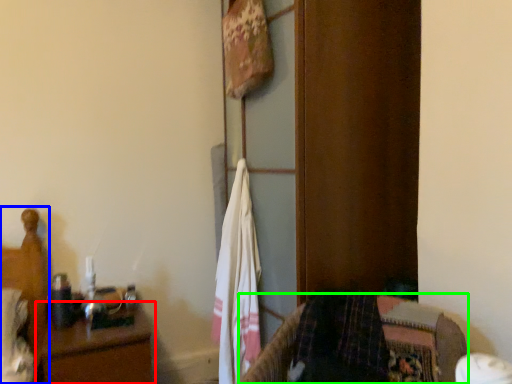
Question: Based on their relative distances, which object is farther from nightstand (highlighted by a red box)? Choose from bed (highlighted by a blue box) and furniture (highlighted by a green box).

Choices:
 (A) bed
 (B) furniture

Answer: (B)